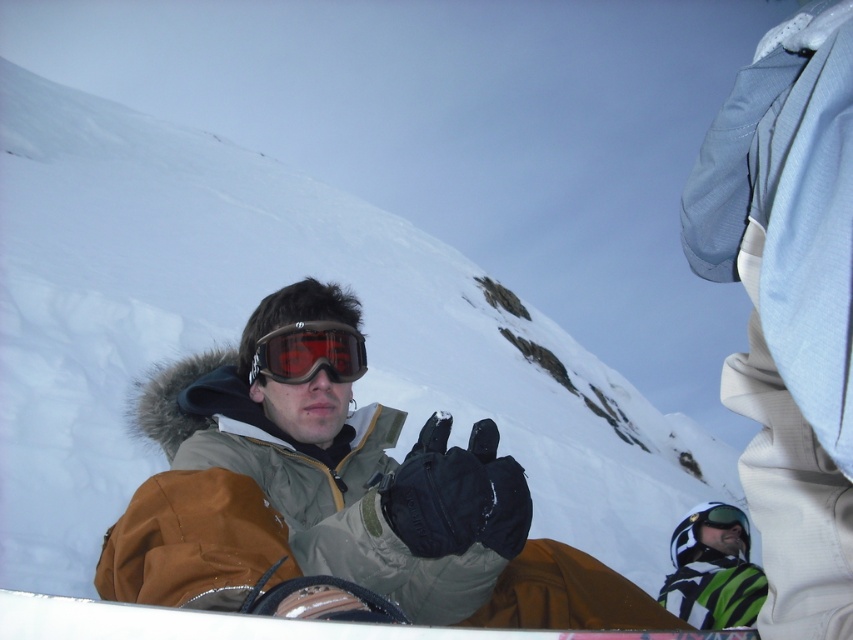
Question: Which point is farther to the camera?

Choices:
 (A) brown leather snowboard at lower center
 (B) matte black goggles at center

Answer: (B)

Question: Does brown leather snowboard at lower center appear on the left side of matte black goggles at center?

Choices:
 (A) no
 (B) yes

Answer: (A)

Question: Does brown leather snowboard at lower center have a lesser width compared to matte black goggles at center?

Choices:
 (A) yes
 (B) no

Answer: (B)

Question: Can you confirm if brown leather snowboard at lower center is positioned to the left of matte black goggles at center?

Choices:
 (A) no
 (B) yes

Answer: (A)

Question: Among these points, which one is farthest from the camera?

Choices:
 (A) pyautogui.click(x=264, y=355)
 (B) pyautogui.click(x=213, y=636)

Answer: (A)